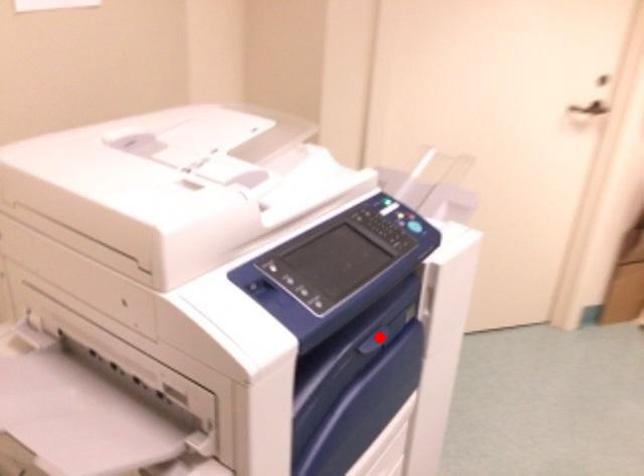
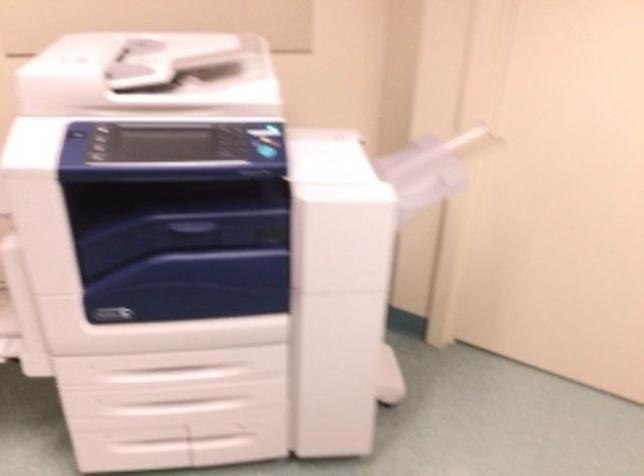
In the second image, find the point that corresponds to the highlighted location in the first image.

(196, 231)